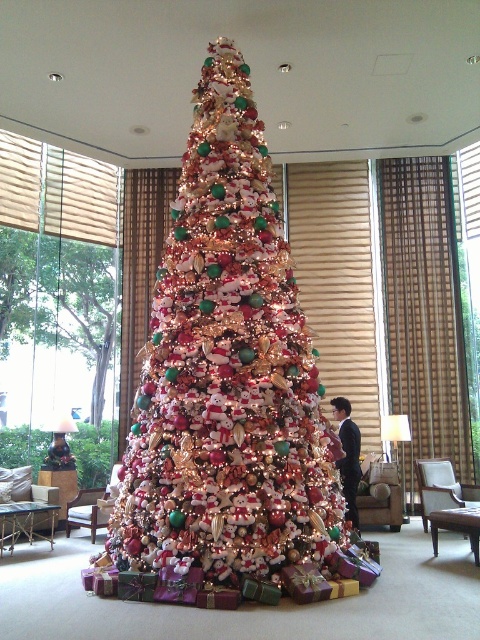
Question: Considering the real-world distances, which object is closest to the shiny metallic christmas tree at center?

Choices:
 (A) smooth black suit at center
 (B) green matte christmas tree at left

Answer: (A)

Question: Considering the relative positions of shiny metallic christmas tree at center and smooth black suit at center in the image provided, where is shiny metallic christmas tree at center located with respect to smooth black suit at center?

Choices:
 (A) right
 (B) left

Answer: (B)

Question: Can you confirm if shiny metallic christmas tree at center is positioned to the right of green matte christmas tree at left?

Choices:
 (A) yes
 (B) no

Answer: (A)

Question: Which point is closer to the camera?

Choices:
 (A) (97, 253)
 (B) (352, 497)
 (C) (156, 472)

Answer: (C)

Question: Which of the following is the closest to the observer?

Choices:
 (A) (325, 420)
 (B) (119, 257)
 (C) (354, 522)

Answer: (A)

Question: Is green matte christmas tree at left to the left of smooth black suit at center from the viewer's perspective?

Choices:
 (A) yes
 (B) no

Answer: (A)